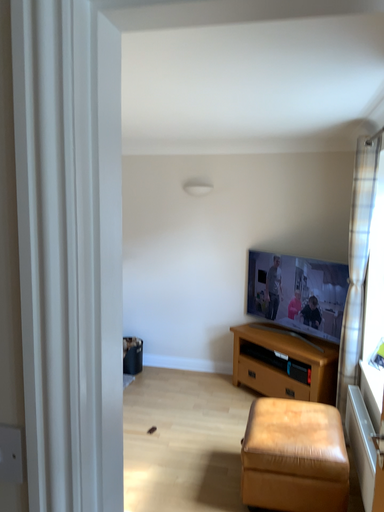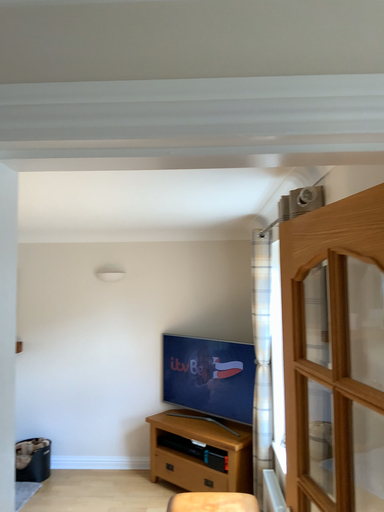
Question: Which way did the camera rotate in the video?

Choices:
 (A) rotated right
 (B) rotated left

Answer: (A)